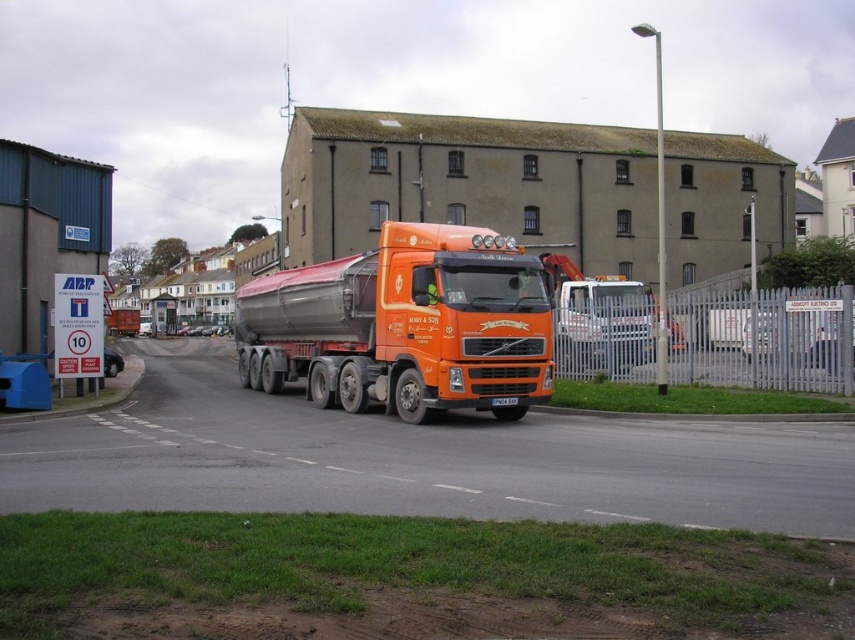
Is orange matte tanker truck at center positioned at the back of orange metallic truck at center?

No, orange matte tanker truck at center is in front of orange metallic truck at center.

Can you confirm if orange matte tanker truck at center is wider than orange metallic truck at center?

In fact, orange matte tanker truck at center might be narrower than orange metallic truck at center.

Image resolution: width=855 pixels, height=640 pixels. Describe the element at coordinates (405, 324) in the screenshot. I see `orange matte tanker truck at center` at that location.

I want to click on orange matte tanker truck at center, so click(405, 324).